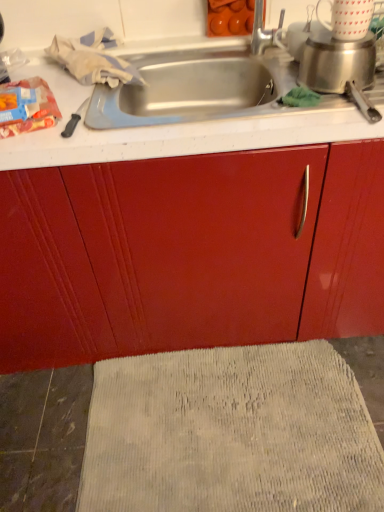
Question: Is beige textured bath mat at lower center wider than matte plastic bag of chips at left?

Choices:
 (A) yes
 (B) no

Answer: (A)

Question: From the image's perspective, is beige textured bath mat at lower center located above matte plastic bag of chips at left?

Choices:
 (A) yes
 (B) no

Answer: (B)

Question: From a real-world perspective, does beige textured bath mat at lower center sit lower than matte plastic bag of chips at left?

Choices:
 (A) yes
 (B) no

Answer: (A)

Question: Considering the relative sizes of beige textured bath mat at lower center and matte plastic bag of chips at left in the image provided, is beige textured bath mat at lower center bigger than matte plastic bag of chips at left?

Choices:
 (A) yes
 (B) no

Answer: (A)

Question: From a real-world perspective, is beige textured bath mat at lower center positioned over matte plastic bag of chips at left based on gravity?

Choices:
 (A) yes
 (B) no

Answer: (B)

Question: Can you confirm if beige textured bath mat at lower center is taller than matte plastic bag of chips at left?

Choices:
 (A) no
 (B) yes

Answer: (B)

Question: Is matte plastic bag of chips at left facing away from beige textured bath mat at lower center?

Choices:
 (A) yes
 (B) no

Answer: (B)

Question: Is beige textured bath mat at lower center completely or partially inside matte plastic bag of chips at left?

Choices:
 (A) no
 (B) yes

Answer: (A)

Question: Does matte plastic bag of chips at left turn towards beige textured bath mat at lower center?

Choices:
 (A) yes
 (B) no

Answer: (B)

Question: From the image's perspective, does matte plastic bag of chips at left appear lower than beige textured bath mat at lower center?

Choices:
 (A) yes
 (B) no

Answer: (B)

Question: From the image's perspective, is matte plastic bag of chips at left on beige textured bath mat at lower center?

Choices:
 (A) no
 (B) yes

Answer: (B)

Question: Is matte plastic bag of chips at left far from beige textured bath mat at lower center?

Choices:
 (A) no
 (B) yes

Answer: (B)

Question: From their relative heights in the image, would you say matte plastic bag of chips at left is taller or shorter than beige textured bath mat at lower center?

Choices:
 (A) tall
 (B) short

Answer: (B)